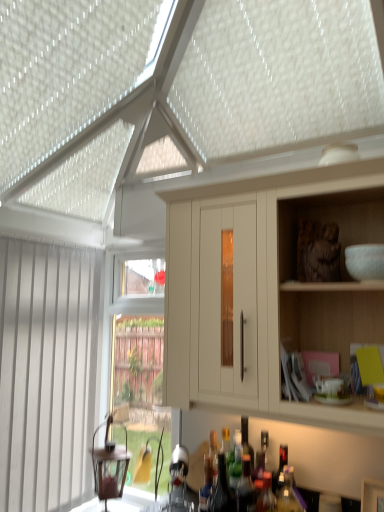
Measure the distance between point (211, 511) and camera.

They are 1.47 meters apart.

Image resolution: width=384 pixels, height=512 pixels. What do you see at coordinates (266, 495) in the screenshot? I see `translucent glass bottle at lower center, positioned as the second bottle in right-to-left order` at bounding box center [266, 495].

Measure the distance between translucent glass bottle at lower center, the fifth bottle from the right, and camera.

translucent glass bottle at lower center, the fifth bottle from the right, is 1.49 meters from camera.

Locate an element on the screen. translucent glass bottle at center, positioned as the second bottle in left-to-right order is located at coordinates (222, 490).

Considering the relative positions of translucent glass bottle at center, acting as the 5th bottle starting from the left, and translucent glass bottle at lower center, acting as the 4th bottle starting from the left, in the image provided, is translucent glass bottle at center, acting as the 5th bottle starting from the left, to the left of translucent glass bottle at lower center, acting as the 4th bottle starting from the left, from the viewer's perspective?

No.

Which is nearer, (259, 463) or (269, 505)?

Point (259, 463) is positioned farther from the camera compared to point (269, 505).

Where is `the 1st bottle to the left of the translucent glass bottle at center, which is counted as the 1th bottle, starting from the right, counting from the anchor's position`? the 1st bottle to the left of the translucent glass bottle at center, which is counted as the 1th bottle, starting from the right, counting from the anchor's position is located at coordinates (266, 495).

Is translucent glass bottle at center, which is counted as the 1th bottle, starting from the right, touching translucent glass bottle at lower center, acting as the 4th bottle starting from the left?

translucent glass bottle at center, which is counted as the 1th bottle, starting from the right, and translucent glass bottle at lower center, acting as the 4th bottle starting from the left, are not in contact.

What are the coordinates of `the 2nd bottle to the left of the translucent glass bottle at lower center, positioned as the second bottle in right-to-left order, counting from the anchor's position` in the screenshot? It's located at (222, 490).

Would you consider translucent glass bottle at center, positioned as the second bottle in left-to-right order, to be distant from translucent glass bottle at lower center, acting as the 4th bottle starting from the left?

translucent glass bottle at center, positioned as the second bottle in left-to-right order, is actually quite close to translucent glass bottle at lower center, acting as the 4th bottle starting from the left.

Is translucent glass bottle at lower center, acting as the 4th bottle starting from the left, inside translucent glass bottle at center, positioned as the second bottle in left-to-right order?

That's incorrect, translucent glass bottle at lower center, acting as the 4th bottle starting from the left, is not inside translucent glass bottle at center, positioned as the second bottle in left-to-right order.

From a real-world perspective, who is located lower, translucent glass bottle at center, marked as the 4th bottle in a right-to-left arrangement, or translucent glass bottle at lower center, acting as the 4th bottle starting from the left?

translucent glass bottle at lower center, acting as the 4th bottle starting from the left, is physically lower.

Would you say translucent glass bottle at center, which is counted as the 1th bottle, starting from the right, is to the left or to the right of translucent glass bottle at center, positioned as the second bottle in left-to-right order, in the picture?

Based on their positions, translucent glass bottle at center, which is counted as the 1th bottle, starting from the right, is located to the right of translucent glass bottle at center, positioned as the second bottle in left-to-right order.

Considering the sizes of translucent glass bottle at center, which is counted as the 1th bottle, starting from the right, and translucent glass bottle at center, positioned as the second bottle in left-to-right order, in the image, is translucent glass bottle at center, which is counted as the 1th bottle, starting from the right, wider or thinner than translucent glass bottle at center, positioned as the second bottle in left-to-right order,?

Considering their sizes, translucent glass bottle at center, which is counted as the 1th bottle, starting from the right, looks slimmer than translucent glass bottle at center, positioned as the second bottle in left-to-right order.

From a real-world perspective, is translucent glass bottle at center, acting as the 5th bottle starting from the left, beneath translucent glass bottle at center, positioned as the second bottle in left-to-right order?

Incorrect, from a real-world perspective, translucent glass bottle at center, acting as the 5th bottle starting from the left, is higher than translucent glass bottle at center, positioned as the second bottle in left-to-right order.

Is translucent glass bottle at center, which is counted as the 1th bottle, starting from the right, oriented towards translucent glass bottle at center, positioned as the second bottle in left-to-right order?

Yes, translucent glass bottle at center, which is counted as the 1th bottle, starting from the right, is aimed at translucent glass bottle at center, positioned as the second bottle in left-to-right order.

Looking at this image, is translucent glass bottle at center, positioned as the second bottle in left-to-right order, next to white vertical blinds at left?

translucent glass bottle at center, positioned as the second bottle in left-to-right order, is not next to white vertical blinds at left, and they're not touching.

Which is in front, point (225, 504) or point (48, 293)?

The point (225, 504) is closer to the camera.

Considering the sizes of objects translucent glass bottle at center, marked as the 4th bottle in a right-to-left arrangement, and white vertical blinds at left in the image provided, who is smaller, translucent glass bottle at center, marked as the 4th bottle in a right-to-left arrangement, or white vertical blinds at left?

Smaller between the two is translucent glass bottle at center, marked as the 4th bottle in a right-to-left arrangement.

Can we say translucent glass bottle at center, positioned as the second bottle in left-to-right order, lies outside white vertical blinds at left?

Yes, translucent glass bottle at center, positioned as the second bottle in left-to-right order, is located beyond the bounds of white vertical blinds at left.

From a real-world perspective, which is physically below, translucent glass bottle at lower center, positioned as the 3th bottle in left-to-right order, or matte white cabinet at upper right?

From a 3D spatial view, translucent glass bottle at lower center, positioned as the 3th bottle in left-to-right order, is below.

Between translucent glass bottle at lower center, positioned as the 3th bottle in left-to-right order, and matte white cabinet at upper right, which one has more height?

matte white cabinet at upper right is taller.

Does translucent glass bottle at lower center, which appears as the third bottle when viewed from the right, come behind matte white cabinet at upper right?

Yes, the depth of translucent glass bottle at lower center, which appears as the third bottle when viewed from the right, is greater than that of matte white cabinet at upper right.

Is translucent glass bottle at lower center, positioned as the 3th bottle in left-to-right order, not near matte white cabinet at upper right?

That's not correct — translucent glass bottle at lower center, positioned as the 3th bottle in left-to-right order, is a little close to matte white cabinet at upper right.

In the scene shown: Would you say translucent glass bottle at lower center, acting as the 4th bottle starting from the left, is to the left or to the right of translucent glass bottle at center, marked as the 4th bottle in a right-to-left arrangement, in the picture?

Based on their positions, translucent glass bottle at lower center, acting as the 4th bottle starting from the left, is located to the right of translucent glass bottle at center, marked as the 4th bottle in a right-to-left arrangement.

From a real-world perspective, between translucent glass bottle at lower center, acting as the 4th bottle starting from the left, and translucent glass bottle at center, marked as the 4th bottle in a right-to-left arrangement, who is vertically lower?

translucent glass bottle at lower center, acting as the 4th bottle starting from the left, is physically lower.

Based on the photo, based on their sizes in the image, would you say translucent glass bottle at lower center, acting as the 4th bottle starting from the left, is bigger or smaller than translucent glass bottle at center, positioned as the second bottle in left-to-right order?

Clearly, translucent glass bottle at lower center, acting as the 4th bottle starting from the left, is smaller in size than translucent glass bottle at center, positioned as the second bottle in left-to-right order.

Is translucent glass bottle at center, positioned as the second bottle in left-to-right order, placed right next to translucent glass bottle at center, which is counted as the 1th bottle, starting from the right?

No, translucent glass bottle at center, positioned as the second bottle in left-to-right order, is not beside translucent glass bottle at center, which is counted as the 1th bottle, starting from the right.

From the image's perspective, would you say translucent glass bottle at center, marked as the 4th bottle in a right-to-left arrangement, is shown under translucent glass bottle at center, acting as the 5th bottle starting from the left?

No, from the image's perspective, translucent glass bottle at center, marked as the 4th bottle in a right-to-left arrangement, is not beneath translucent glass bottle at center, acting as the 5th bottle starting from the left.

Is translucent glass bottle at center, positioned as the second bottle in left-to-right order, thinner than translucent glass bottle at center, acting as the 5th bottle starting from the left?

No.

There is a translucent glass bottle at center, acting as the 5th bottle starting from the left. At what (x,y) coordinates should I click in order to perform the action: click on the 4th bottle below it (from a real-world perspective). Please return your answer as a coordinate pair (x, y). The image size is (384, 512). Looking at the image, I should click on (266, 495).

From the image's perspective, which bottle is the 1st one below the translucent glass bottle at center, positioned as the second bottle in left-to-right order? Please provide its 2D coordinates.

[(266, 495)]

Looking at the image, which one is located closer to white vertical blinds at left, translucent glass bottle at center, acting as the 5th bottle starting from the left, or translucent glass bottle at lower center, the fifth bottle from the right?

translucent glass bottle at lower center, the fifth bottle from the right.

Which object lies nearer to the anchor point translucent glass bottle at lower center, positioned as the second bottle in right-to-left order, translucent glass bottle at center, marked as the 4th bottle in a right-to-left arrangement, or translucent glass bottle at center, which is counted as the 1th bottle, starting from the right?

translucent glass bottle at center, which is counted as the 1th bottle, starting from the right.

Looking at this image, which object lies further to the anchor point white vertical blinds at left, translucent glass bottle at center, marked as the 4th bottle in a right-to-left arrangement, or translucent glass bottle at lower center, positioned as the 3th bottle in left-to-right order?

Based on the image, translucent glass bottle at lower center, positioned as the 3th bottle in left-to-right order, appears to be further to white vertical blinds at left.

Based on their spatial positions, is translucent glass bottle at lower center, positioned as the second bottle in right-to-left order, or white vertical blinds at left closer to matte white cabinet at upper right?

translucent glass bottle at lower center, positioned as the second bottle in right-to-left order, is positioned closer to the anchor matte white cabinet at upper right.

Which object lies further to the anchor point translucent glass bottle at lower center, acting as the 4th bottle starting from the left, translucent glass bottle at center, acting as the 5th bottle starting from the left, or translucent glass bottle at lower center, the fifth bottle from the right?

translucent glass bottle at lower center, the fifth bottle from the right, lies further to translucent glass bottle at lower center, acting as the 4th bottle starting from the left, than the other object.

Looking at the image, which one is located further to translucent glass bottle at lower center, which appears as the third bottle when viewed from the right, translucent glass bottle at center, positioned as the second bottle in left-to-right order, or translucent glass bottle at lower center, acting as the first bottle starting from the left?

translucent glass bottle at lower center, acting as the first bottle starting from the left, is further to translucent glass bottle at lower center, which appears as the third bottle when viewed from the right.

Considering their positions, is translucent glass bottle at lower center, positioned as the second bottle in right-to-left order, positioned closer to translucent glass bottle at center, which is counted as the 1th bottle, starting from the right, than translucent glass bottle at center, marked as the 4th bottle in a right-to-left arrangement?

translucent glass bottle at lower center, positioned as the second bottle in right-to-left order, lies closer to translucent glass bottle at center, which is counted as the 1th bottle, starting from the right, than the other object.

Based on their spatial positions, is matte white cabinet at upper right or white vertical blinds at left further from translucent glass bottle at lower center, the fifth bottle from the right?

Based on the image, white vertical blinds at left appears to be further to translucent glass bottle at lower center, the fifth bottle from the right.

The image size is (384, 512). Find the location of `bottle between matte white cabinet at upper right and translucent glass bottle at center, marked as the 4th bottle in a right-to-left arrangement, vertically`. bottle between matte white cabinet at upper right and translucent glass bottle at center, marked as the 4th bottle in a right-to-left arrangement, vertically is located at coordinates (246, 488).

Where is `bottle between white vertical blinds at left and translucent glass bottle at center, positioned as the second bottle in left-to-right order, from left to right`? bottle between white vertical blinds at left and translucent glass bottle at center, positioned as the second bottle in left-to-right order, from left to right is located at coordinates (x=206, y=485).

The width and height of the screenshot is (384, 512). In order to click on bottle situated between translucent glass bottle at center, positioned as the second bottle in left-to-right order, and translucent glass bottle at lower center, positioned as the second bottle in right-to-left order, from left to right in this screenshot , I will do `click(246, 488)`.